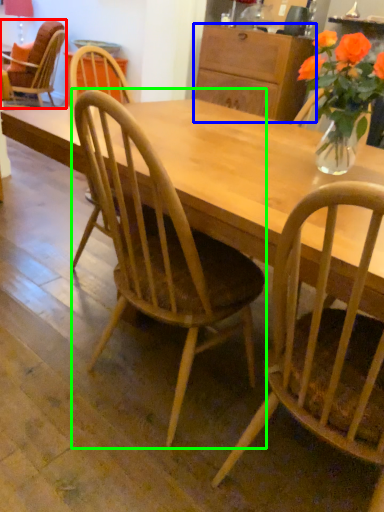
Question: Considering the real-world distances, which object is closest to chair (highlighted by a red box)? cabinetry (highlighted by a blue box) or chair (highlighted by a green box).

Choices:
 (A) cabinetry
 (B) chair

Answer: (A)